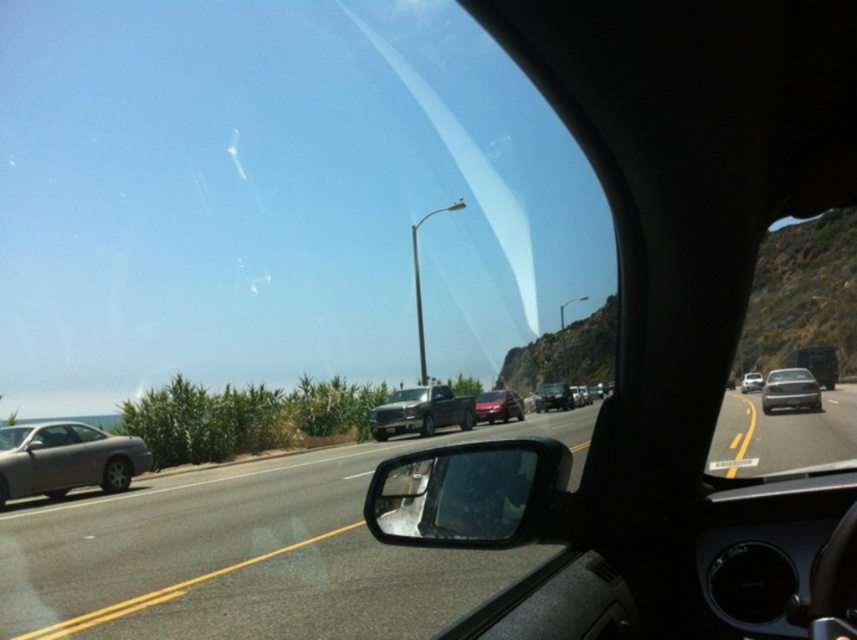
Measure the distance between point (428, 394) and camera.

The distance of point (428, 394) from camera is 26.47 meters.

Who is taller, matte black truck at center or metallic silver sedan at right?

Standing taller between the two is metallic silver sedan at right.

You are a GUI agent. You are given a task and a screenshot of the screen. Output one action in this format:
    pyautogui.click(x=<x>, y=<y>)
    Task: Click on the matte black truck at center
    The width and height of the screenshot is (857, 640).
    Given the screenshot: What is the action you would take?
    pyautogui.click(x=421, y=412)

Where is `matte black truck at center`? This screenshot has width=857, height=640. matte black truck at center is located at coordinates (421, 412).

Is black glossy sedan at center in front of metallic red truck at center?

Yes, black glossy sedan at center is in front of metallic red truck at center.

This screenshot has width=857, height=640. What do you see at coordinates (781, 435) in the screenshot? I see `black glossy sedan at center` at bounding box center [781, 435].

You are a GUI agent. You are given a task and a screenshot of the screen. Output one action in this format:
    pyautogui.click(x=<x>, y=<y>)
    Task: Click on the black glossy sedan at center
    This screenshot has width=857, height=640.
    Given the screenshot: What is the action you would take?
    pyautogui.click(x=781, y=435)

Is gray asphalt road at center bigger than satin silver sedan at left?

Yes, gray asphalt road at center is bigger than satin silver sedan at left.

Which is behind, point (376, 618) or point (40, 451)?

Positioned behind is point (40, 451).

Does point (75, 566) come behind point (39, 432)?

No, it is in front of (39, 432).

The image size is (857, 640). In order to click on gray asphalt road at center in this screenshot , I will do `click(247, 554)`.